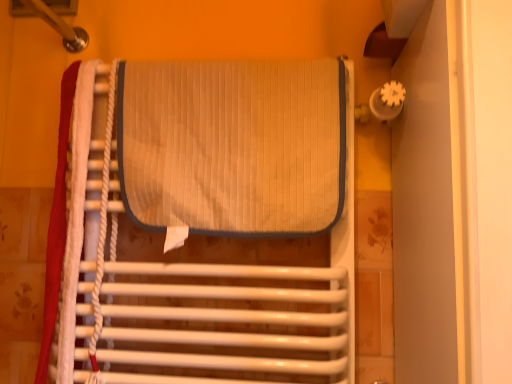
Question: Looking at the image, does beige textured mat at center seem bigger or smaller compared to textured beige mat at center?

Choices:
 (A) big
 (B) small

Answer: (B)

Question: In the image, is beige textured mat at center on the left side or the right side of textured beige mat at center?

Choices:
 (A) left
 (B) right

Answer: (A)

Question: Based on their relative distances, which object is farther from the white rope at left?

Choices:
 (A) beige textured mat at center
 (B) textured beige mat at center

Answer: (A)

Question: Which object is the closest to the textured beige mat at center?

Choices:
 (A) beige textured mat at center
 (B) white rope at left

Answer: (A)